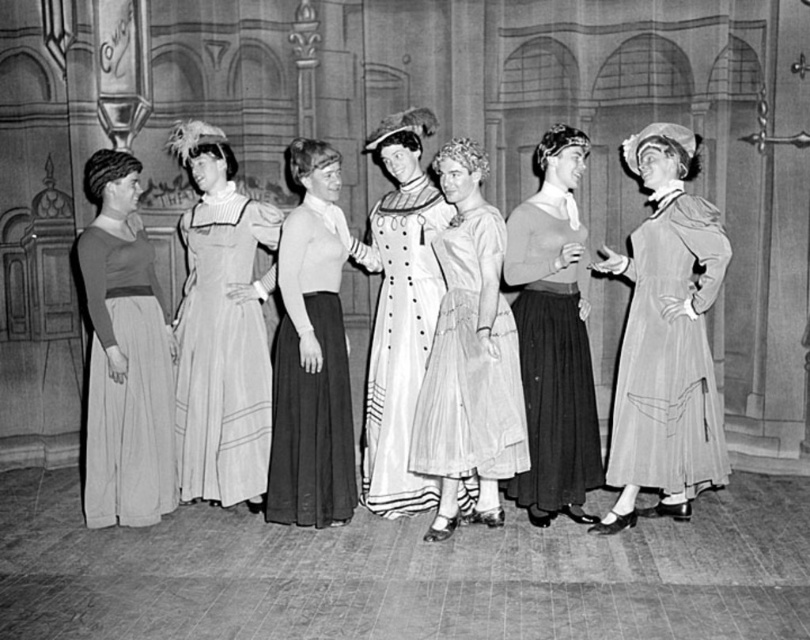
Question: Among these points, which one is farthest from the camera?

Choices:
 (A) (265, 513)
 (B) (501, 445)
 (C) (551, 289)
 (D) (372, 355)

Answer: (D)

Question: Which point is farther to the camera?

Choices:
 (A) (188, 296)
 (B) (632, 308)
 (C) (103, 168)

Answer: (A)

Question: Which is nearer to the matte black dress at left?

Choices:
 (A) white satin dress at center
 (B) silky white dress at center
 (C) matte white dress at center

Answer: (A)

Question: Where is silky gray dress at center located in relation to matte black dress at left in the image?

Choices:
 (A) below
 (B) above

Answer: (B)

Question: In this image, where is silky white dress at center located relative to matte white dress at center?

Choices:
 (A) below
 (B) above

Answer: (A)

Question: Is light pink satin dress at center thinner than matte black dress at left?

Choices:
 (A) yes
 (B) no

Answer: (B)